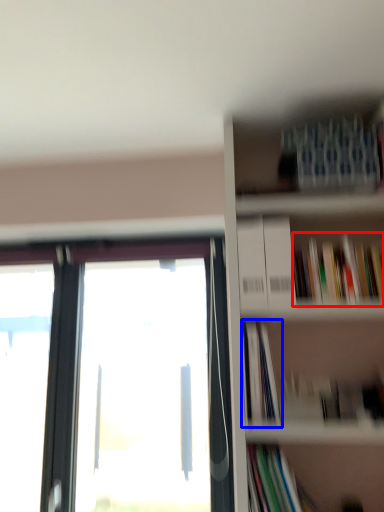
Question: Which point is further to the camera, book (highlighted by a red box) or book (highlighted by a blue box)?

Choices:
 (A) book
 (B) book

Answer: (A)